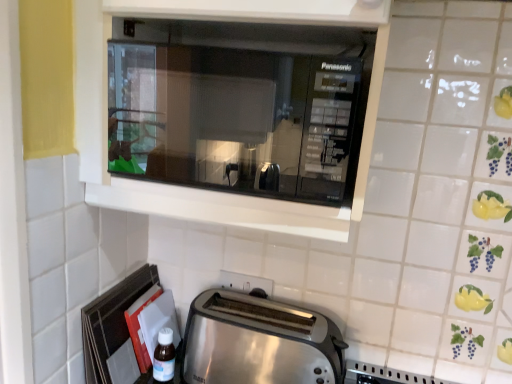
Question: Would you say satin silver toaster at lower center is inside or outside transparent plastic bottle at lower left?

Choices:
 (A) outside
 (B) inside

Answer: (A)

Question: Is satin silver toaster at lower center taller or shorter than transparent plastic bottle at lower left?

Choices:
 (A) short
 (B) tall

Answer: (B)

Question: Which object is positioned closest to the black glass microwave at upper center?

Choices:
 (A) satin silver toaster at lower center
 (B) white plastic electric outlet at lower center
 (C) transparent plastic bottle at lower left

Answer: (A)

Question: Estimate the real-world distances between objects in this image. Which object is closer to the transparent plastic bottle at lower left?

Choices:
 (A) black glass microwave at upper center
 (B) white plastic electric outlet at lower center
 (C) satin silver toaster at lower center

Answer: (C)